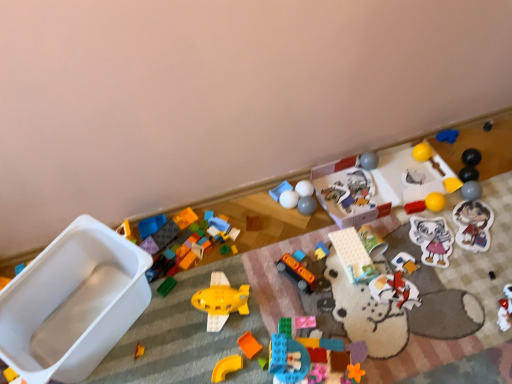
The height and width of the screenshot is (384, 512). What are the coordinates of `vacant space that's between orange plastic block at lower left, acting as the 23th toy starting from the right, and white plastic container at left, arranged as the 25th toy when viewed from the right` in the screenshot? It's located at (140, 344).